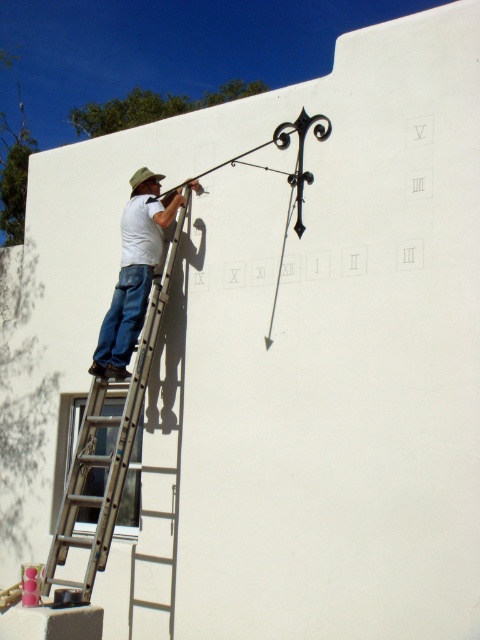
You are standing in front of the wall with the clock face markings. You see the silver metallic ladder at left and the white matte shirt at upper left. Which object is positioned higher on the wall?

The white matte shirt at upper left is positioned higher on the wall than the silver metallic ladder at left.

You are a painter standing in front of the wall. You need to reach the white matte shirt at upper left to touch it. Can you reach it without moving the silver metallic ladder at left?

The silver metallic ladder at left is in front of the white matte shirt at upper left, so you cannot reach the white matte shirt at upper left without moving the ladder first.